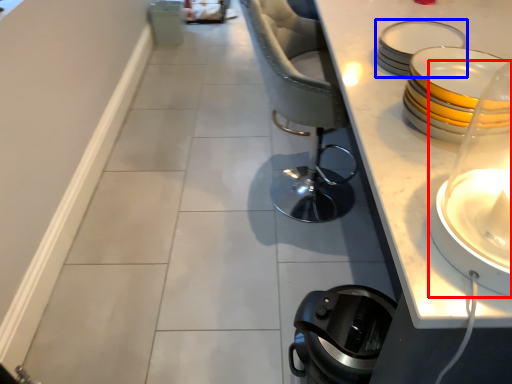
Question: Among these objects, which one is nearest to the camera, candle holder (highlighted by a red box) or tableware (highlighted by a blue box)?

Choices:
 (A) candle holder
 (B) tableware

Answer: (A)